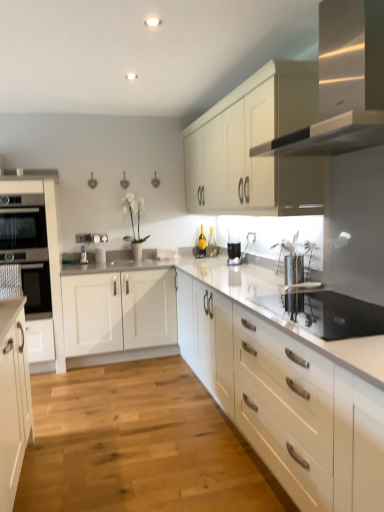
Question: Should I look upward or downward to see light wood floor at center?

Choices:
 (A) down
 (B) up

Answer: (A)

Question: Is there a large distance between light wood floor at center and white matte cabinet at upper center, marked as the second cabinetry in a right-to-left arrangement?

Choices:
 (A) no
 (B) yes

Answer: (B)

Question: Could you tell me if light wood floor at center is turned towards white matte cabinet at upper center, marked as the second cabinetry in a right-to-left arrangement?

Choices:
 (A) yes
 (B) no

Answer: (B)

Question: Considering the relative sizes of light wood floor at center and white matte cabinet at upper center, marked as the second cabinetry in a right-to-left arrangement, in the image provided, is light wood floor at center wider than white matte cabinet at upper center, marked as the second cabinetry in a right-to-left arrangement,?

Choices:
 (A) no
 (B) yes

Answer: (B)

Question: Is light wood floor at center at the right side of white matte cabinet at upper center, which is counted as the 2th cabinetry, starting from the left?

Choices:
 (A) yes
 (B) no

Answer: (B)

Question: Is the position of light wood floor at center more distant than that of white matte cabinet at upper center, which is counted as the 2th cabinetry, starting from the left?

Choices:
 (A) yes
 (B) no

Answer: (B)

Question: Considering the relative sizes of light wood floor at center and white matte cabinet at upper center, which is counted as the 2th cabinetry, starting from the left, in the image provided, is light wood floor at center taller than white matte cabinet at upper center, which is counted as the 2th cabinetry, starting from the left,?

Choices:
 (A) no
 (B) yes

Answer: (A)

Question: Can we say satin nickel faucet at center lies outside white matte cabinet at center, the third cabinetry from the left?

Choices:
 (A) no
 (B) yes

Answer: (B)

Question: Is satin nickel faucet at center positioned in front of white matte cabinet at center, the third cabinetry from the left?

Choices:
 (A) no
 (B) yes

Answer: (A)

Question: From the image's perspective, is satin nickel faucet at center located above white matte cabinet at center, the 1th cabinetry viewed from the right?

Choices:
 (A) no
 (B) yes

Answer: (B)

Question: Are satin nickel faucet at center and white matte cabinet at center, the 1th cabinetry viewed from the right, located far from each other?

Choices:
 (A) no
 (B) yes

Answer: (B)

Question: Can you confirm if satin nickel faucet at center is smaller than white matte cabinet at center, the 1th cabinetry viewed from the right?

Choices:
 (A) no
 (B) yes

Answer: (B)

Question: Could white matte cabinet at center, the third cabinetry from the left, be considered to be inside satin nickel faucet at center?

Choices:
 (A) no
 (B) yes

Answer: (A)

Question: Can satin silver range hood at upper right be found inside satin white oven at left, the third cabinetry viewed from the right?

Choices:
 (A) yes
 (B) no

Answer: (B)